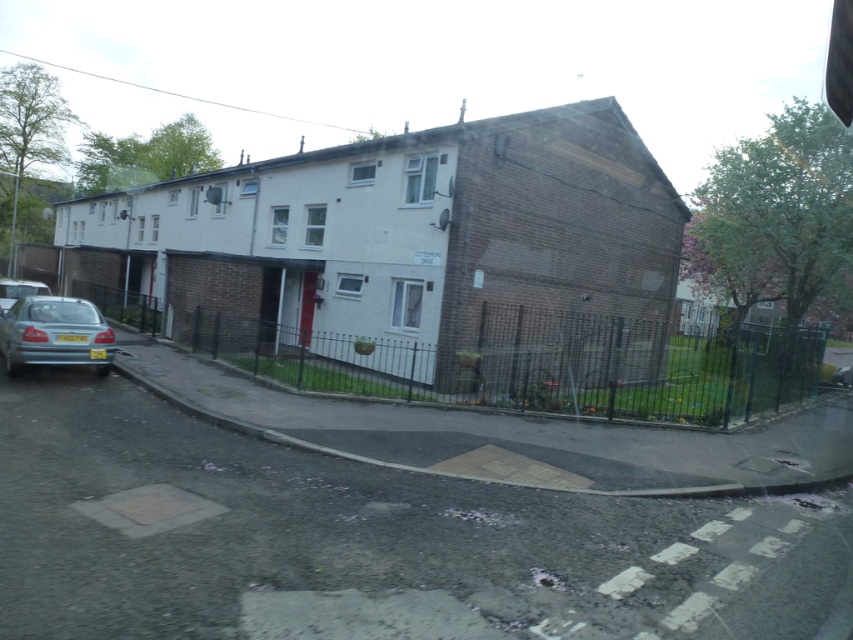
Question: Where is silver metallic car at lower left located in relation to metallic silver car at left in the image?

Choices:
 (A) right
 (B) left

Answer: (A)

Question: Which of the following is the farthest from the observer?

Choices:
 (A) (102, 365)
 (B) (10, 285)

Answer: (B)

Question: Is silver metallic car at lower left wider than metallic silver car at left?

Choices:
 (A) no
 (B) yes

Answer: (A)

Question: Where is silver metallic car at lower left located in relation to metallic silver car at left in the image?

Choices:
 (A) below
 (B) above

Answer: (A)

Question: Which point is closer to the camera?

Choices:
 (A) (9, 278)
 (B) (97, 358)

Answer: (B)